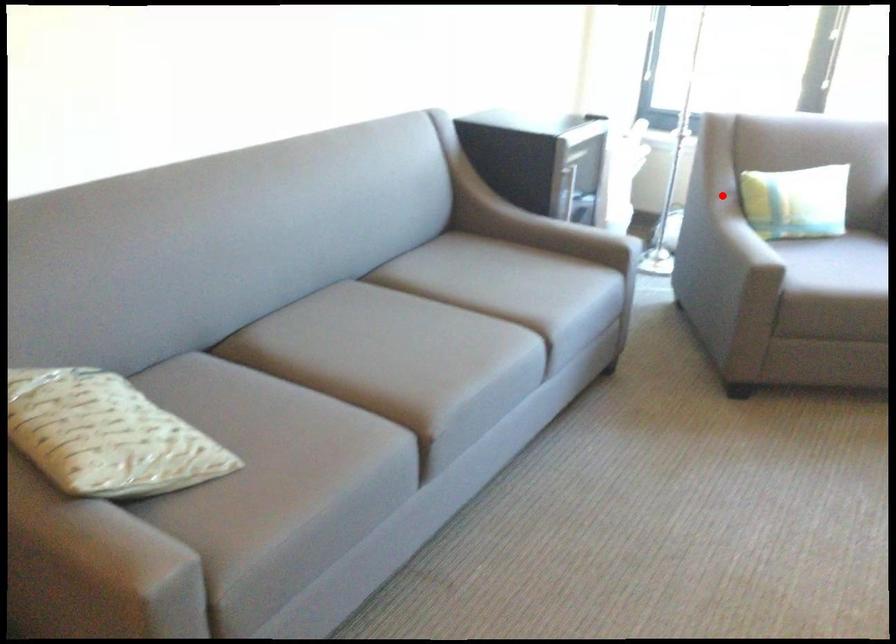
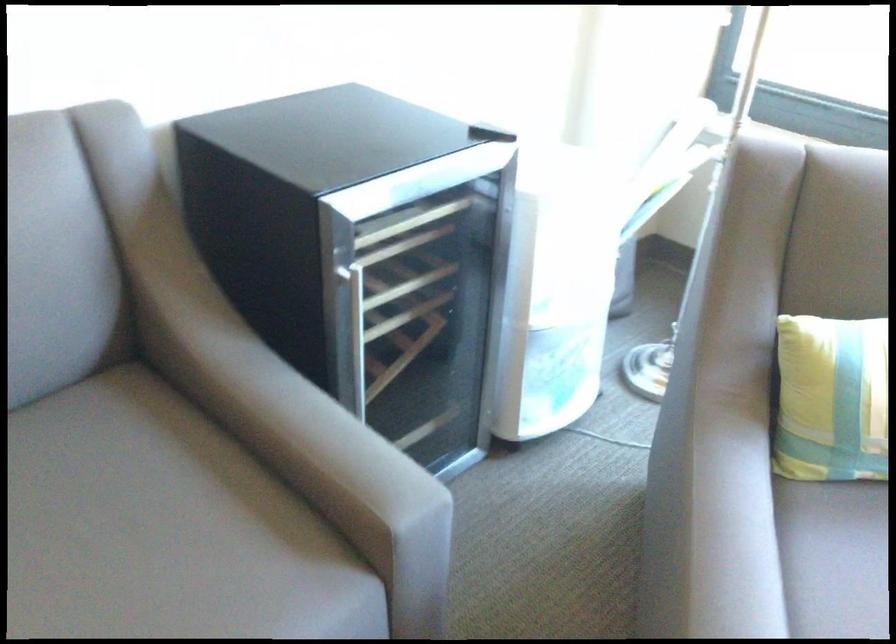
Locate, in the second image, the point that corresponds to the highlighted location in the first image.

(831, 399)